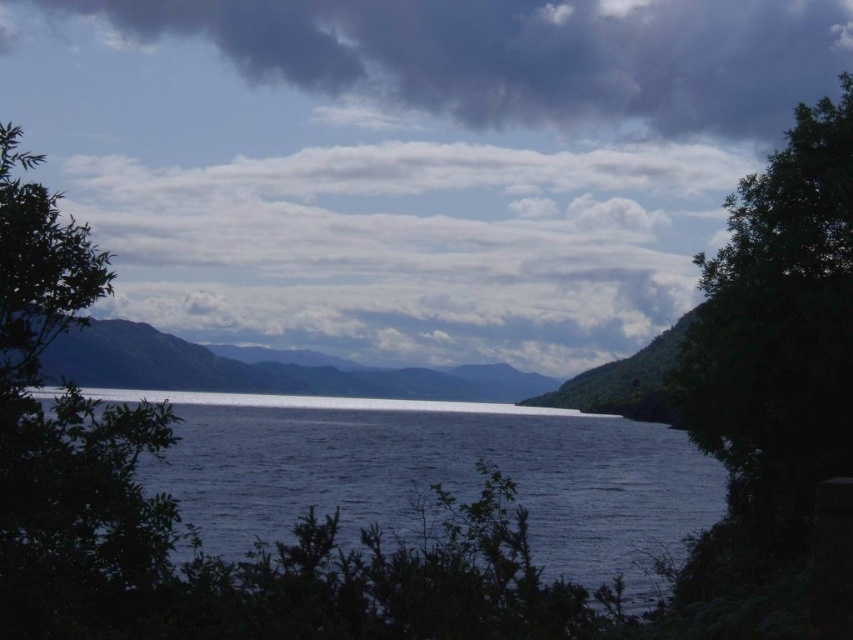
Question: Which is farther from the dark gray cloud at upper center?

Choices:
 (A) green leafy tree at right
 (B) smooth gray mountain at center
 (C) dark blue water at center

Answer: (A)

Question: Is green leafy tree at right smaller than green leafy tree at left?

Choices:
 (A) no
 (B) yes

Answer: (A)

Question: Can you confirm if dark blue water at center is thinner than smooth gray mountain at center?

Choices:
 (A) no
 (B) yes

Answer: (B)

Question: Which point is farther to the camera?

Choices:
 (A) dark blue water at center
 (B) green leafy tree at left

Answer: (A)

Question: Considering the real-world distances, which object is closest to the green leafy tree at right?

Choices:
 (A) dark gray cloud at upper center
 (B) smooth gray mountain at center
 (C) dark blue water at center

Answer: (C)

Question: Is dark blue water at center further to the viewer compared to smooth gray mountain at center?

Choices:
 (A) no
 (B) yes

Answer: (A)